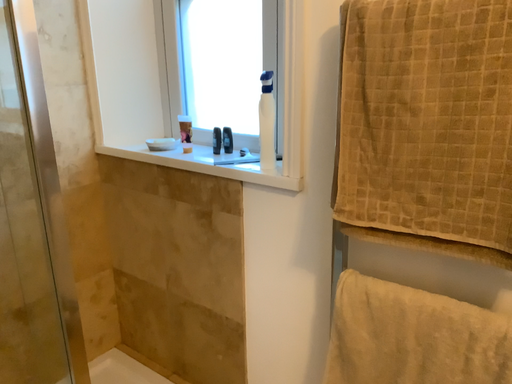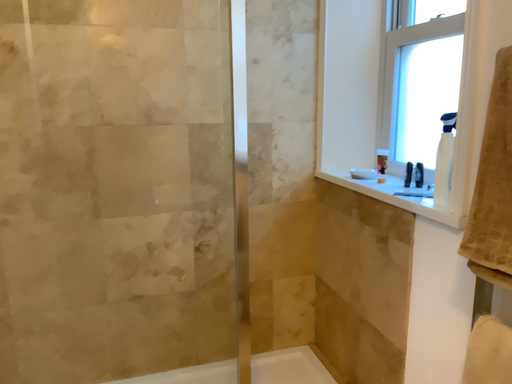
Question: How did the camera likely rotate when shooting the video?

Choices:
 (A) rotated left
 (B) rotated right

Answer: (A)